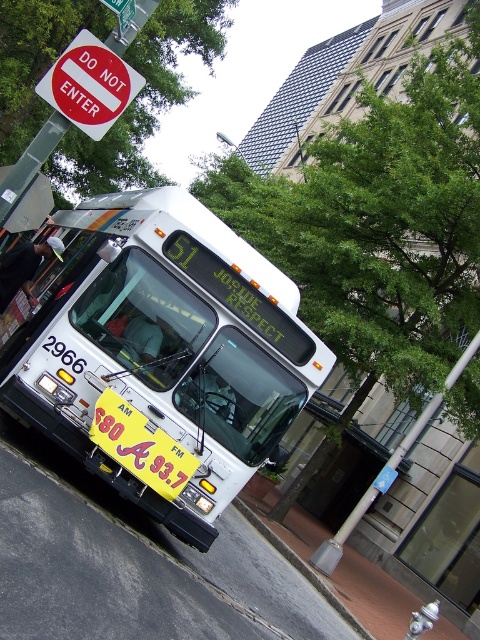
You are standing on the sidewalk and want to cross the street to reach the bus stop. The bus you need is the one with the route number 51 displayed on its digital sign. There is a point marked at coordinates (97, 308) in the image. Can you safely cross the street to reach the bus stop without getting too close to the bus, considering you are 6.38 meters away from that point?

The point marked at coordinates (97, 308) is 6.38 meters away from you. Since you need to cross the street to reach the bus stop, you can safely do so while maintaining a safe distance from the bus as long as you stay at least 6.38 meters away from that point.

You are a city planner analyzing traffic flow. You need to determine if the white metallic bus at center can be easily seen by drivers approaching from the left side of the street. Considering the size of the red plastic sign at upper left, which is smaller than the bus, would the bus obstruct the view of the sign to drivers coming from the left?

The white metallic bus at center has a larger size compared to the red plastic sign at upper left. Since the bus is bigger, it could potentially block the view of the smaller red plastic sign at upper left for drivers approaching from the left side of the street.